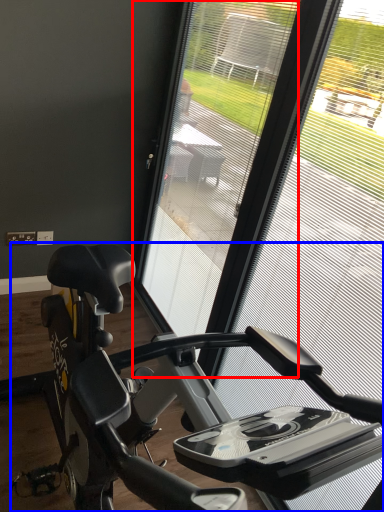
Question: Which point is further to the camera, screen door (highlighted by a red box) or stationary bicycle (highlighted by a blue box)?

Choices:
 (A) screen door
 (B) stationary bicycle

Answer: (A)